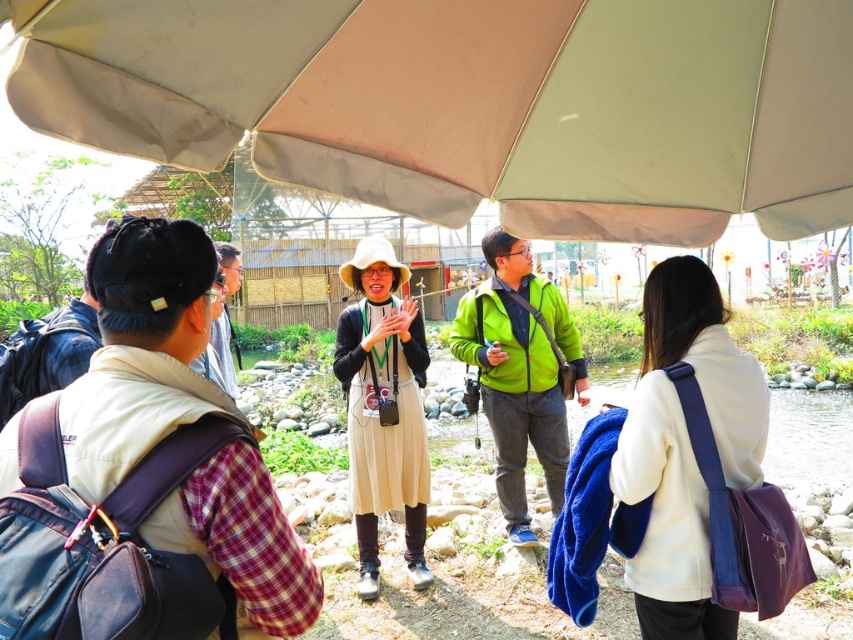
Question: Among these objects, which one is farthest from the camera?

Choices:
 (A) beige fabric dress at center
 (B) beige fabric canopy at upper center

Answer: (A)

Question: Is beige fabric canopy at upper center thinner than white fabric coat at lower right?

Choices:
 (A) yes
 (B) no

Answer: (B)

Question: Which point appears closest to the camera in this image?

Choices:
 (A) (656, 540)
 (B) (399, 275)
 (C) (155, 148)

Answer: (C)

Question: From the image, what is the correct spatial relationship of beige fabric canopy at upper center in relation to beige fabric dress at center?

Choices:
 (A) left
 (B) right

Answer: (B)

Question: Is beige fabric canopy at upper center to the right of white fabric coat at lower right from the viewer's perspective?

Choices:
 (A) no
 (B) yes

Answer: (A)

Question: Which object is closer to the camera taking this photo?

Choices:
 (A) beige fabric dress at center
 (B) white fabric coat at lower right

Answer: (B)